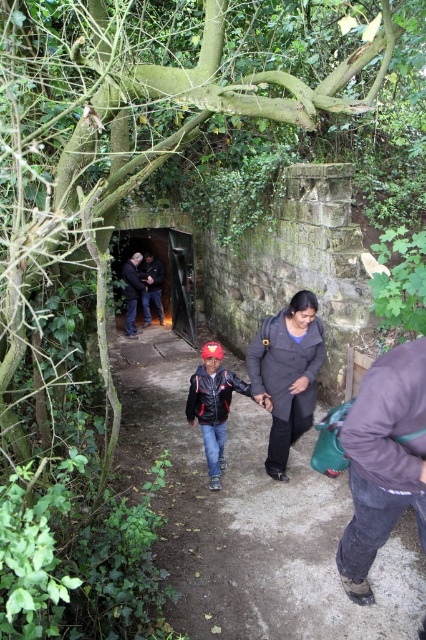
You are standing at the entrance of the stone structure and notice the dark brown fabric pants at lower right. Based on their position, can you estimate how close they are to the entrance?

The dark brown fabric pants at lower right are located at point 0.720 on the x and 0.901 on the y axis, which places them relatively close to the entrance of the stone structure.

You are a hiker carrying a backpack and see the dark stone tunnel at center and the dark gray jacket at center. Which object is larger in size?

The dark stone tunnel at center is bigger than the dark gray jacket at center according to the description.

You are a hiker trying to pass through the narrow pathway. You see two people wearing the matte black jacket at center and dark blue jacket at center. Which jacket is wider so that you can estimate the space needed to pass?

The matte black jacket at center is wider than the dark blue jacket at center, so you should estimate the space based on the width of the matte black jacket at center to ensure safe passage.